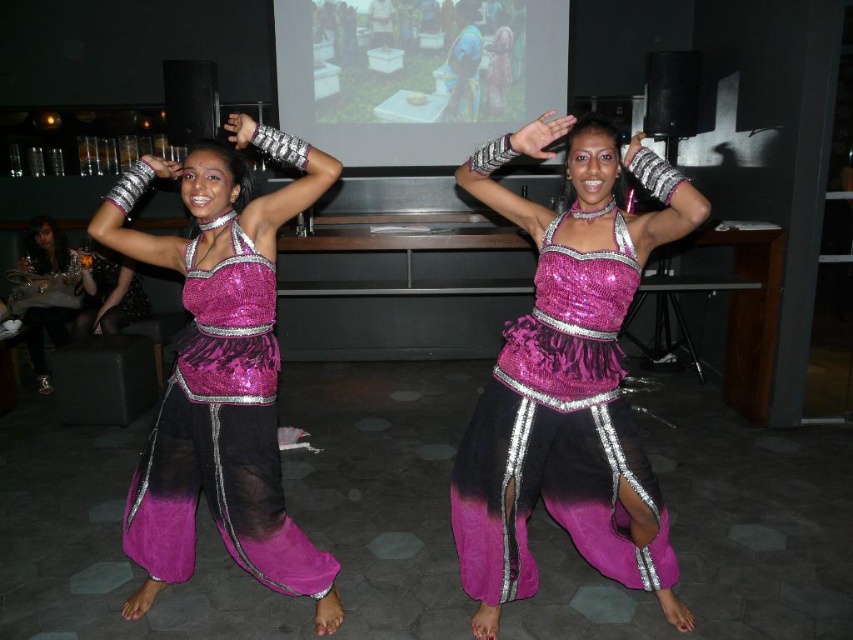
Based on the photo, you are a photographer at the event and want to capture a photo of the fuchsia sequined dress at center and the matte black dress at lower left. Since the lighting is low, you need to ensure both dresses are fully visible. Which dress should you focus on first to ensure proper exposure?

The fuchsia sequined dress at center is positioned under the matte black dress at lower left. Since the matte black dress at lower left is higher up, it might be closer to the light source, so focusing on it first could help balance the exposure for both dresses.

You are a photographer at the event and want to capture a photo that includes both the fuchsia sequined dress at center and the matte black dress at lower left. Which dress will appear larger in the photo?

A: The fuchsia sequined dress at center will appear larger in the photo because it is closer to the viewer than the matte black dress at lower left.

You are at a party and want to take a photo of the dancers. The camera you have can only focus on objects within 7 feet. Is the point at coordinates point (178, 545) within the camera focus range?

The point at coordinates point (178, 545) is 7.76 feet from the camera, which is beyond the camera focus range of 7 feet. The camera cannot focus on it.